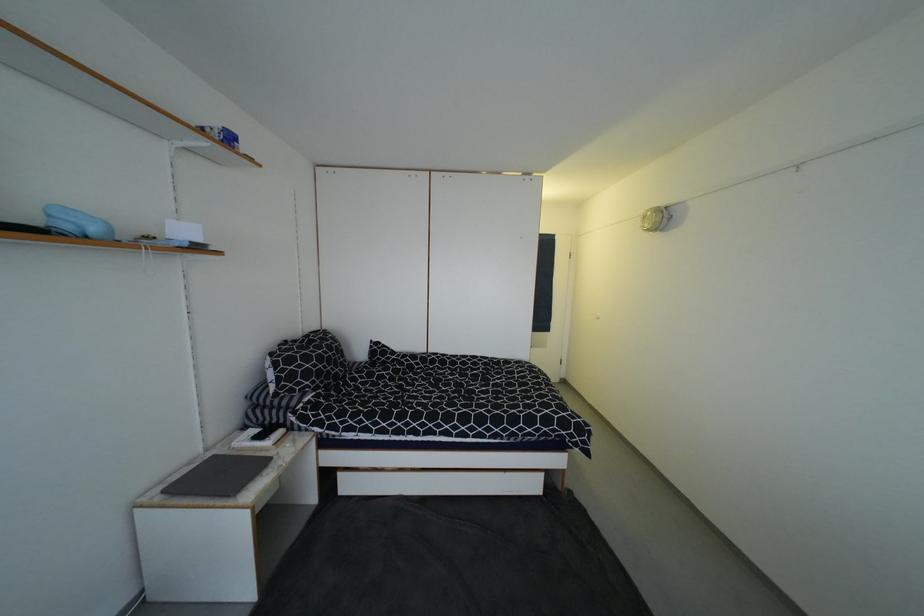
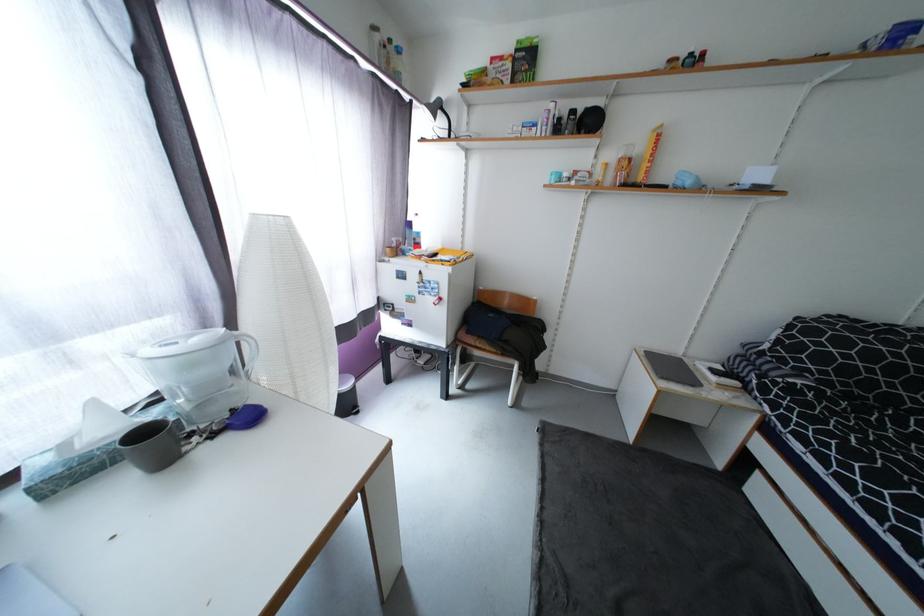
In the second image, find the point that corresponds to [169,493] in the first image.

(650, 353)